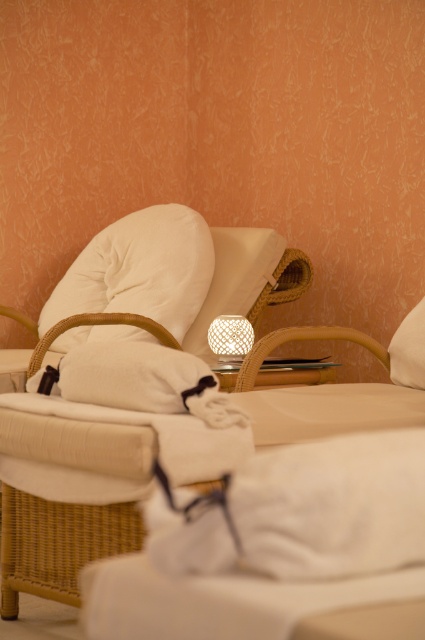
Question: Which point is farther to the camera?

Choices:
 (A) (116, 236)
 (B) (39, 538)
 (C) (224, 349)

Answer: (A)

Question: Which of the following is the closest to the observer?

Choices:
 (A) white soft pillow at upper left
 (B) woven wood armchair at left

Answer: (B)

Question: Is white soft pillow at upper right above woven bamboo lamp at center?

Choices:
 (A) yes
 (B) no

Answer: (A)

Question: Considering the relative positions of white soft bed at center and white soft blanket at lower center in the image provided, where is white soft bed at center located with respect to white soft blanket at lower center?

Choices:
 (A) right
 (B) left

Answer: (B)

Question: Among these points, which one is farthest from the camera?

Choices:
 (A) (408, 333)
 (B) (192, 531)

Answer: (A)

Question: Is white soft bed at center to the right of white soft pillow at upper left from the viewer's perspective?

Choices:
 (A) yes
 (B) no

Answer: (A)